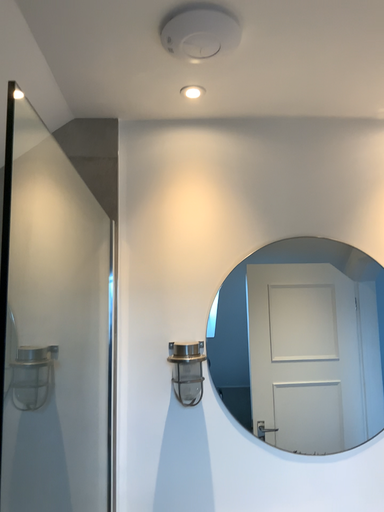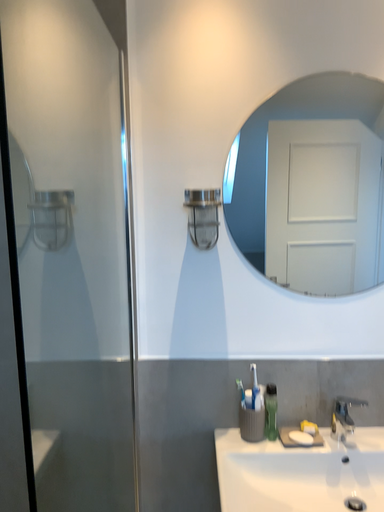
Question: How did the camera likely rotate when shooting the video?

Choices:
 (A) rotated downward
 (B) rotated upward

Answer: (A)